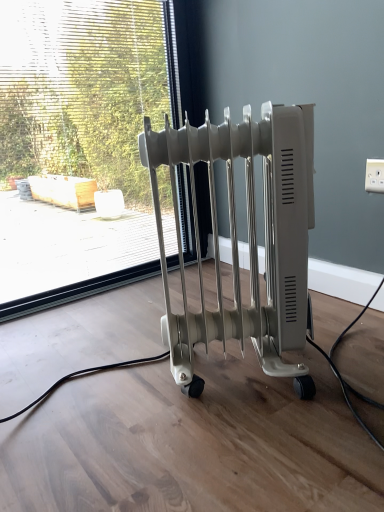
Where is `free spot to the right of white plastic radiator at center`? This screenshot has height=512, width=384. free spot to the right of white plastic radiator at center is located at coordinates (345, 364).